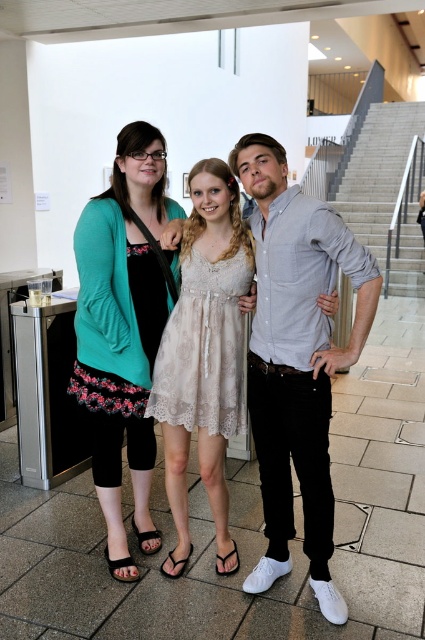
You are standing at the entrance of the building and see the light beige lace dress at center and the teal fabric cardigan at center. Which one is positioned more to the right side?

The light beige lace dress at center is positioned more to the right side than the teal fabric cardigan at center.

You are standing in the modern building and need to locate the light beige lace dress at center. According to the coordinates provided, where exactly is it positioned?

The light beige lace dress at center is located at point 0.559 on the x axis and 0.699 on the y axis.

You are a photographer trying to capture a candid shot of the two people at the center of the image. Given that your camera has a minimum focus distance of 1 inch, will you be able to focus on both the light beige lace dress at center and the light gray cotton shirt at center simultaneously?

The light beige lace dress at center and the light gray cotton shirt at center are 0.77 inches apart, which is less than the camera minimum focus distance of 1 inch. Therefore, the camera can focus on both the light beige lace dress at center and the light gray cotton shirt at center simultaneously.